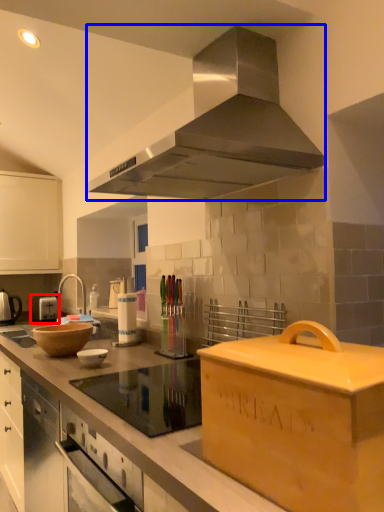
Question: Which of the following is the farthest to the observer, appliance (highlighted by a red box) or home appliance (highlighted by a blue box)?

Choices:
 (A) appliance
 (B) home appliance

Answer: (A)